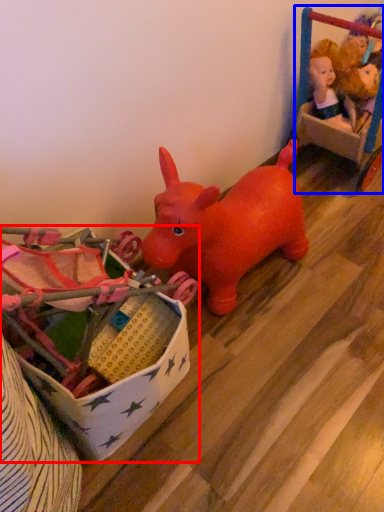
Question: Which object appears farthest to the camera in this image, toy (highlighted by a red box) or toy (highlighted by a blue box)?

Choices:
 (A) toy
 (B) toy

Answer: (B)